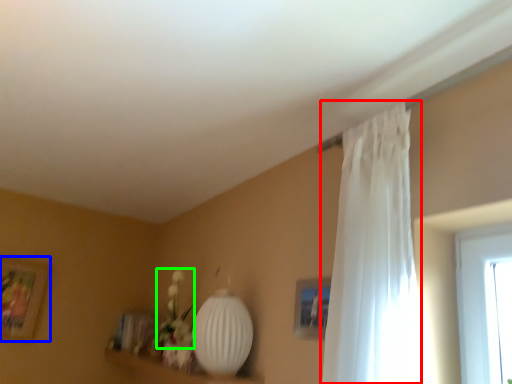
Question: Which is farther away from curtain (highlighted by a red box)? picture frame (highlighted by a blue box) or floral arrangement (highlighted by a green box)?

Choices:
 (A) picture frame
 (B) floral arrangement

Answer: (A)